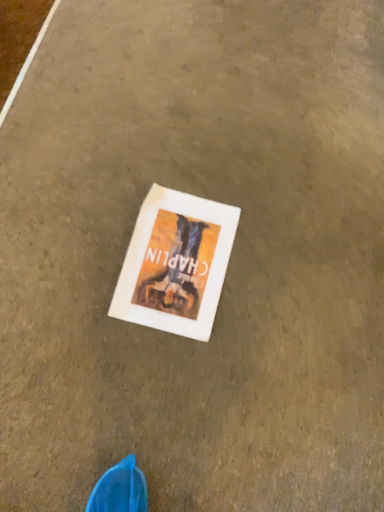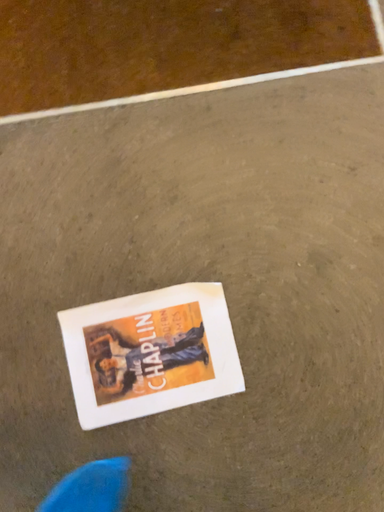
Question: How did the camera likely rotate when shooting the video?

Choices:
 (A) rotated left
 (B) rotated right

Answer: (A)